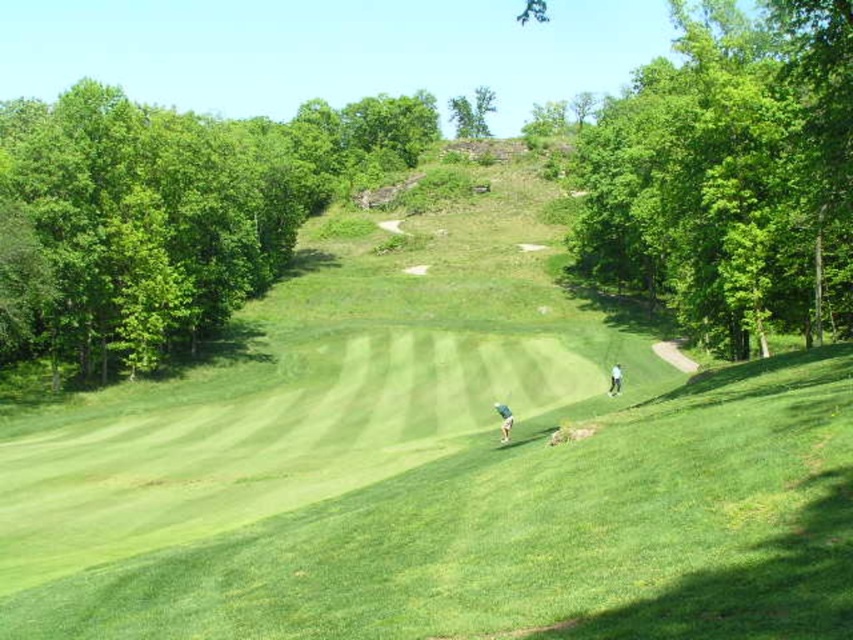
You are a golfer trying to hit the ball into the hole. There is a green leafy tree at upper center and a light brown leather golf club at center in your view. Which object is wider from your perspective?

The green leafy tree at upper center is wider than the light brown leather golf club at center according to the description.

You are a golfer trying to hit the ball into the hole. There is a green leafy trees at left and a light brown leather golf club at center in your view. Which object is bigger in your view?

The green leafy trees at left is larger in size compared to the light brown leather golf club at center, so the green leafy trees at left appears bigger in your view.

You are standing at the center of the golf course and see the point marked as point (165, 220). What is located at that point?

The point (165, 220) marks green leafy trees at left.